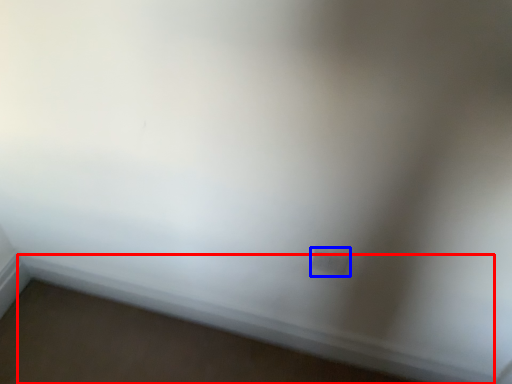
Question: Which point is closer to the camera, window sill (highlighted by a red box) or electric outlet (highlighted by a blue box)?

Choices:
 (A) window sill
 (B) electric outlet

Answer: (B)